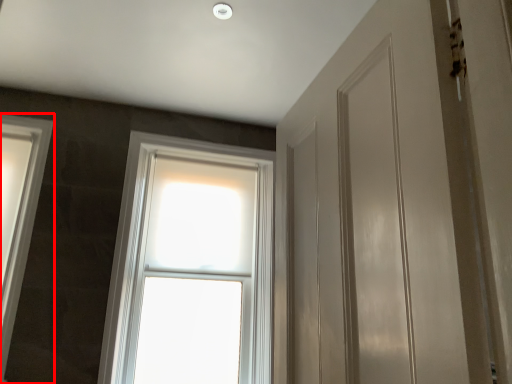
Question: From the image's perspective, what is the correct spatial relationship of window (annotated by the red box) in relation to window?

Choices:
 (A) above
 (B) below

Answer: (A)